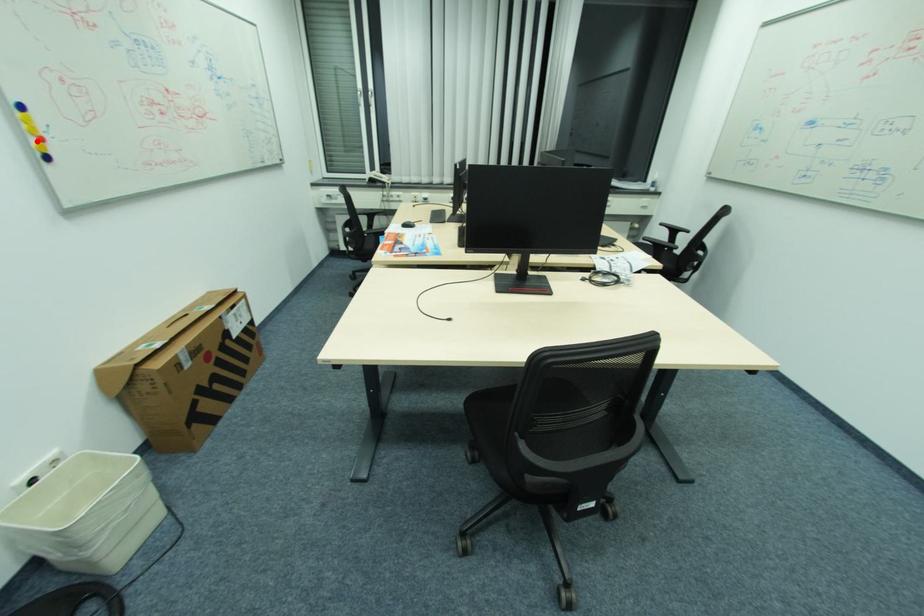
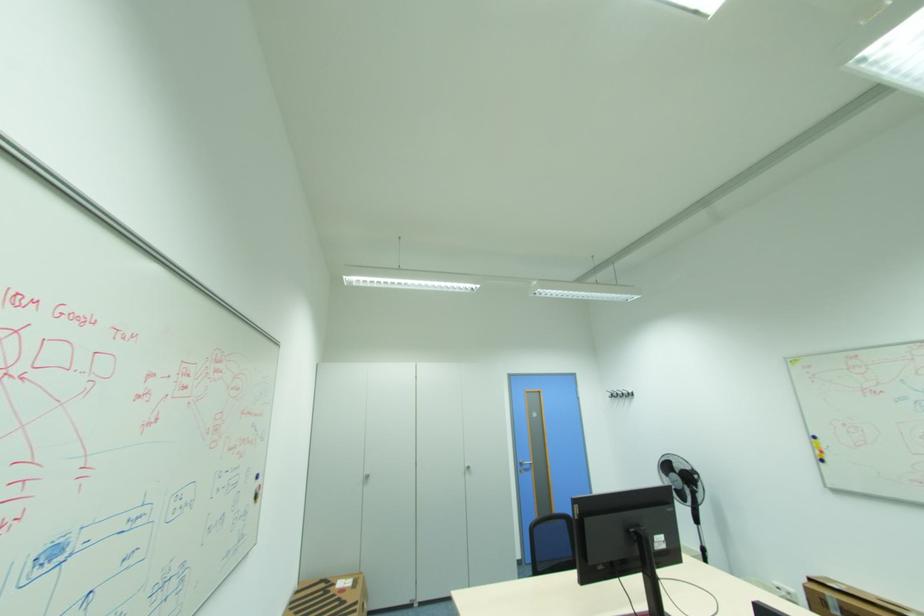
Locate, in the second image, the point that corresponds to the highlighted location in the first image.

(822, 453)